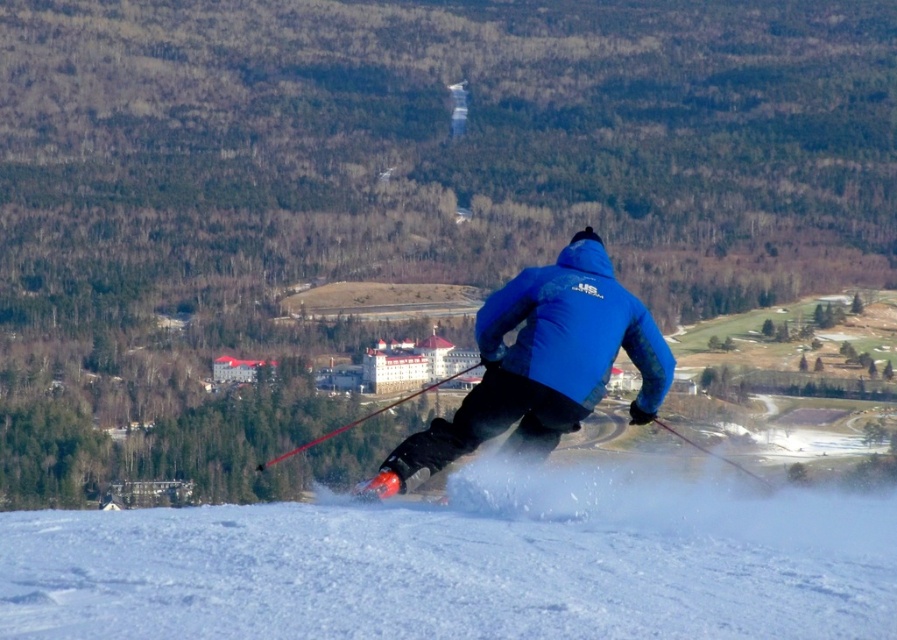
Question: Which object is farther from the camera taking this photo?

Choices:
 (A) white powdery snow at center
 (B) blue matte jacket at center

Answer: (B)

Question: Considering the relative positions of blue matte jacket at center and blue softshell jacket at center in the image provided, where is blue matte jacket at center located with respect to blue softshell jacket at center?

Choices:
 (A) below
 (B) above

Answer: (A)

Question: Is the position of blue matte jacket at center less distant than that of blue softshell jacket at center?

Choices:
 (A) no
 (B) yes

Answer: (B)

Question: Which of the following is the closest to the observer?

Choices:
 (A) blue softshell jacket at center
 (B) blue matte jacket at center
 (C) white powdery snow at center

Answer: (C)

Question: Based on their relative distances, which object is farther from the blue softshell jacket at center?

Choices:
 (A) white powdery snow at center
 (B) blue matte jacket at center

Answer: (A)

Question: Does white powdery snow at center have a greater width compared to blue softshell jacket at center?

Choices:
 (A) yes
 (B) no

Answer: (A)